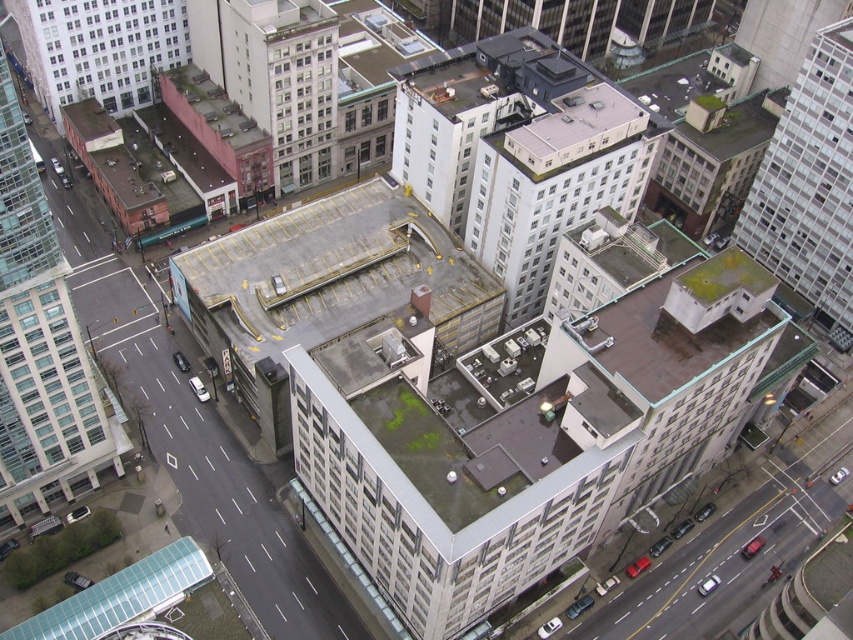
Who is taller, white glass building at upper right or light pink concrete building at upper left?

Standing taller between the two is white glass building at upper right.

Find the location of a particular element. Image resolution: width=853 pixels, height=640 pixels. white glass building at upper right is located at coordinates (809, 186).

Is point (827, 28) behind point (28, 13)?

No, it is in front of (28, 13).

Locate an element on the screen. The image size is (853, 640). white glass building at upper right is located at coordinates (809, 186).

Does glassy white skyscraper at left have a greater width compared to white glass building at upper right?

Indeed, glassy white skyscraper at left has a greater width compared to white glass building at upper right.

Which is more to the right, glassy white skyscraper at left or white glass building at upper right?

Positioned to the right is white glass building at upper right.

Is point (15, 340) in front of point (778, 144)?

Yes, it is in front of point (778, 144).

At what (x,y) coordinates should I click in order to perform the action: click on glassy white skyscraper at left. Please return your answer as a coordinate pair (x, y). The width and height of the screenshot is (853, 640). Looking at the image, I should click on (41, 346).

What do you see at coordinates (41, 346) in the screenshot? The image size is (853, 640). I see `glassy white skyscraper at left` at bounding box center [41, 346].

Which of these two, glassy white skyscraper at left or white matte building at center, stands shorter?

Standing shorter between the two is white matte building at center.

Is point (35, 230) closer to camera compared to point (612, 189)?

Yes, point (35, 230) is in front of point (612, 189).

I want to click on glassy white skyscraper at left, so click(41, 346).